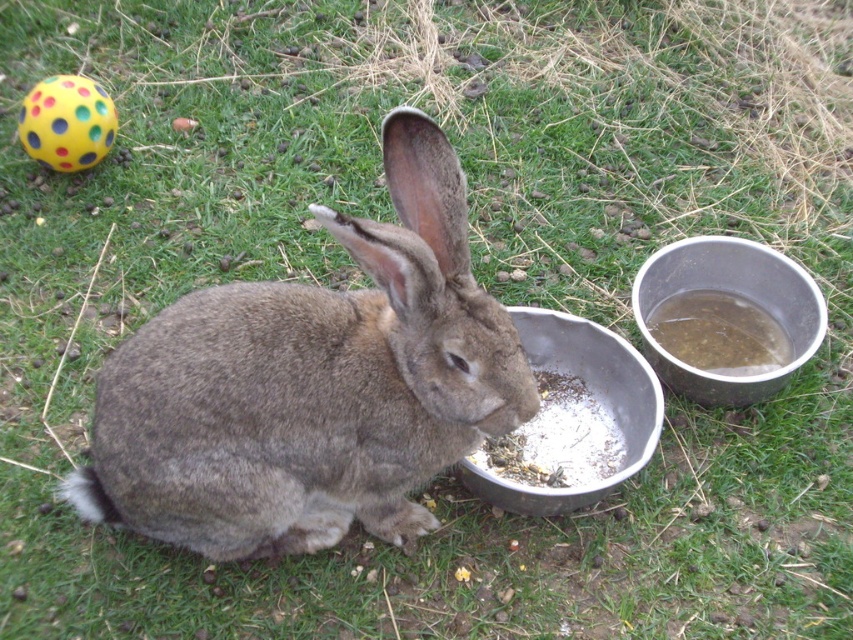
Question: Estimate the real-world distances between objects in this image. Which object is closer to the metallic silver bowl at right?

Choices:
 (A) translucent plastic water at right
 (B) white powder at lower center

Answer: (A)

Question: Which point is farther to the camera?

Choices:
 (A) metallic silver bowl at right
 (B) fuzzy gray rabbit at center
 (C) white powder at lower center
 (D) metallic gray bowl at lower center

Answer: (C)

Question: Is white powder at lower center above translucent plastic water at right?

Choices:
 (A) no
 (B) yes

Answer: (A)

Question: Can you confirm if metallic silver bowl at right is wider than translucent plastic water at right?

Choices:
 (A) no
 (B) yes

Answer: (B)

Question: Is the position of fuzzy gray rabbit at center less distant than that of translucent plastic water at right?

Choices:
 (A) yes
 (B) no

Answer: (A)

Question: Which point appears farthest from the camera in this image?

Choices:
 (A) (547, 412)
 (B) (178, 497)
 (C) (730, 349)

Answer: (C)